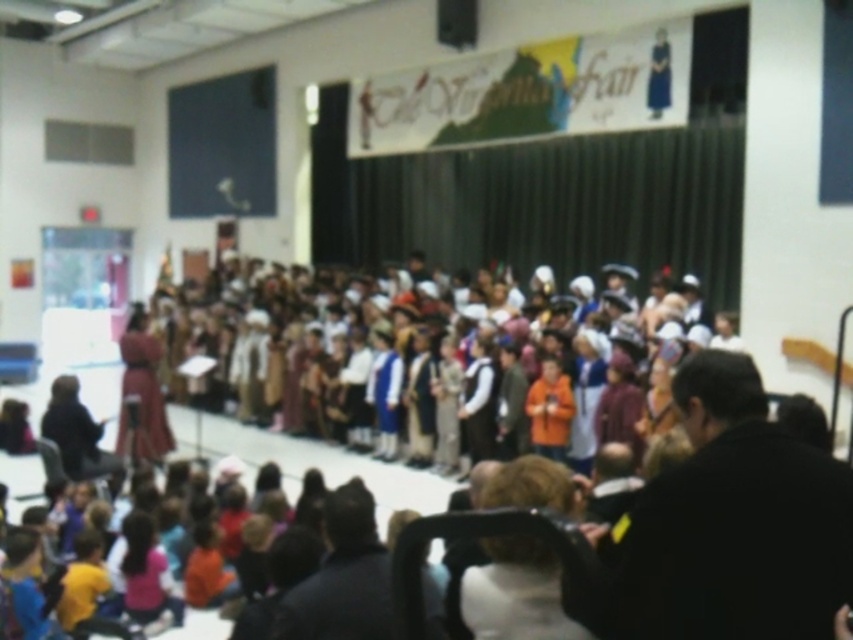
Does multicolored fabric costumes at center appear over velvet maroon dress at center?

Yes.

Does point (236, 406) come farther from viewer compared to point (142, 396)?

That is True.

Where is `multicolored fabric costumes at center`? The width and height of the screenshot is (853, 640). multicolored fabric costumes at center is located at coordinates [x=270, y=346].

Who is positioned more to the right, multicolored fabric costumes at center or pink fabric shirt at lower left?

multicolored fabric costumes at center

Can you confirm if multicolored fabric costumes at center is positioned above pink fabric shirt at lower left?

Yes.

The width and height of the screenshot is (853, 640). I want to click on multicolored fabric costumes at center, so click(270, 346).

Does dark hair at lower center have a larger size compared to pink fabric shirt at lower left?

Indeed, dark hair at lower center has a larger size compared to pink fabric shirt at lower left.

Which is in front, point (346, 552) or point (148, 582)?

Point (346, 552)

The image size is (853, 640). What do you see at coordinates (343, 577) in the screenshot?
I see `dark hair at lower center` at bounding box center [343, 577].

This screenshot has height=640, width=853. I want to click on dark hair at lower center, so click(343, 577).